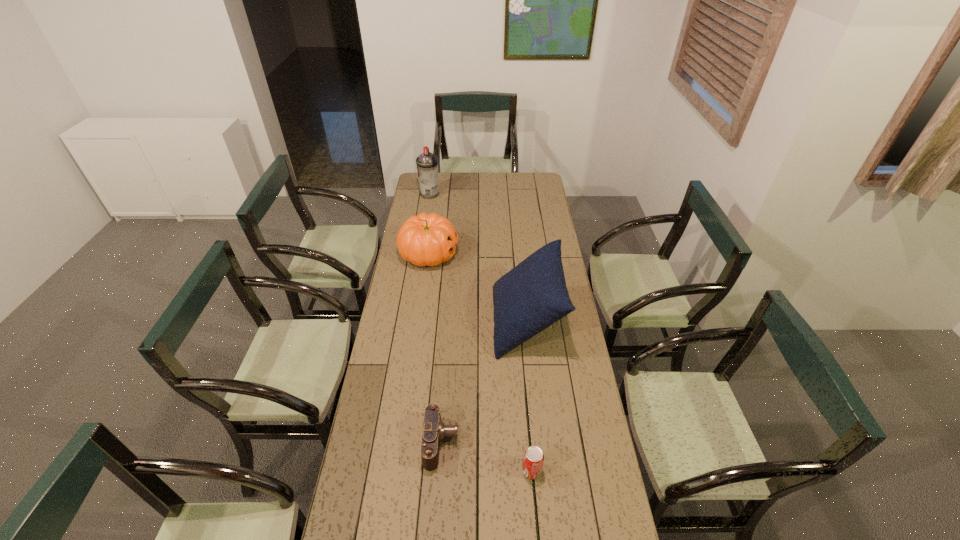
Identify the location of the farthest object. (427, 163).

This screenshot has height=540, width=960. I want to click on the third farthest object, so click(x=532, y=296).

Identify the location of pumpkin. click(x=426, y=239).

Locate an element on the screen. The image size is (960, 540). the third tallest object is located at coordinates (426, 239).

Find the location of `soda can`. soda can is located at coordinates (533, 460).

Where is `camera`? The image size is (960, 540). camera is located at coordinates (434, 430).

Locate an element on the screen. The height and width of the screenshot is (540, 960). vacant position located 0.210m on the right of the farthest object is located at coordinates (477, 194).

The image size is (960, 540). I want to click on vacant space situated on the facing side of the cushion, so click(x=437, y=322).

Locate an element on the screen. This screenshot has width=960, height=540. vacant point located 0.280m on the facing side of the cushion is located at coordinates (424, 322).

Where is `vacant space located 0.230m on the facing side of the cushion`? vacant space located 0.230m on the facing side of the cushion is located at coordinates (437, 322).